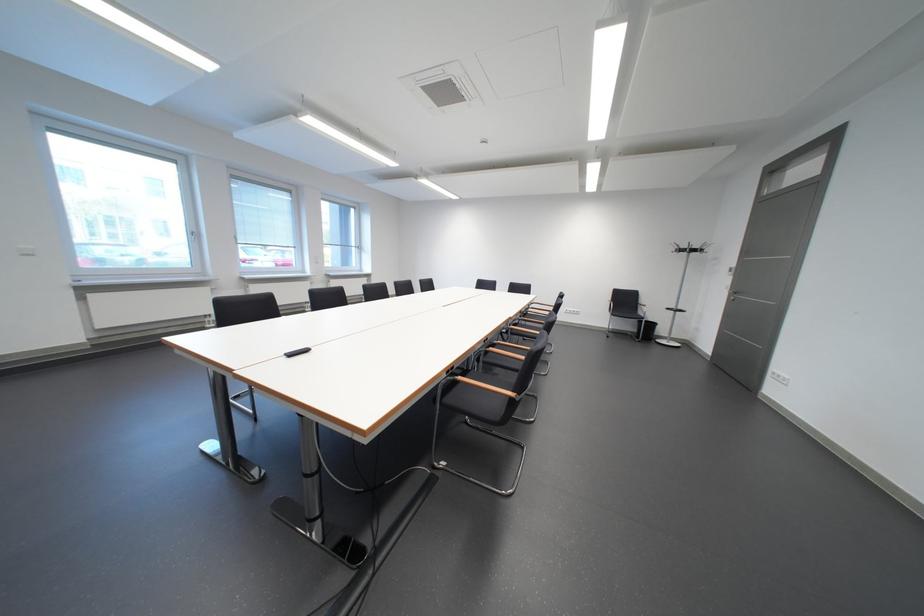
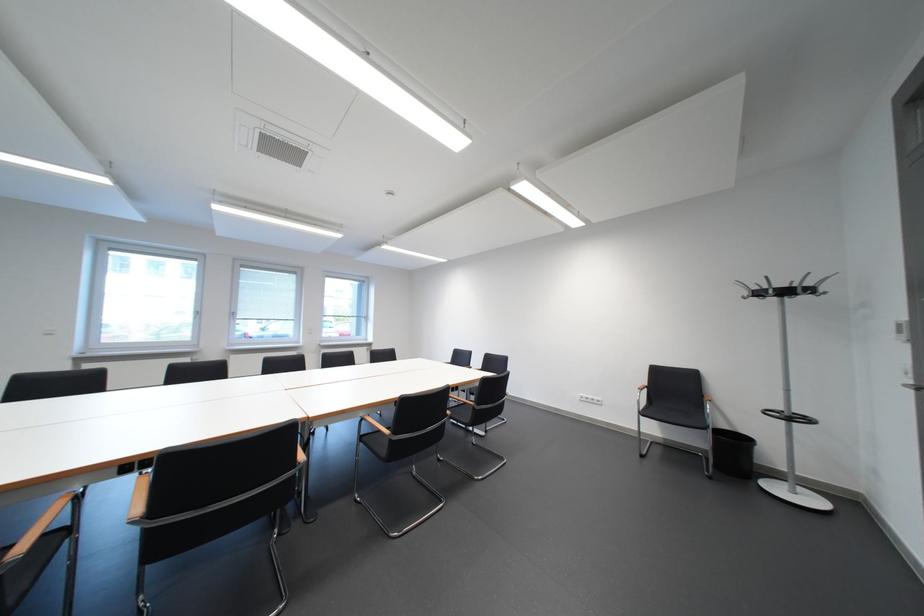
Locate, in the second image, the point that corresponds to [715,252] in the first image.

(823, 292)